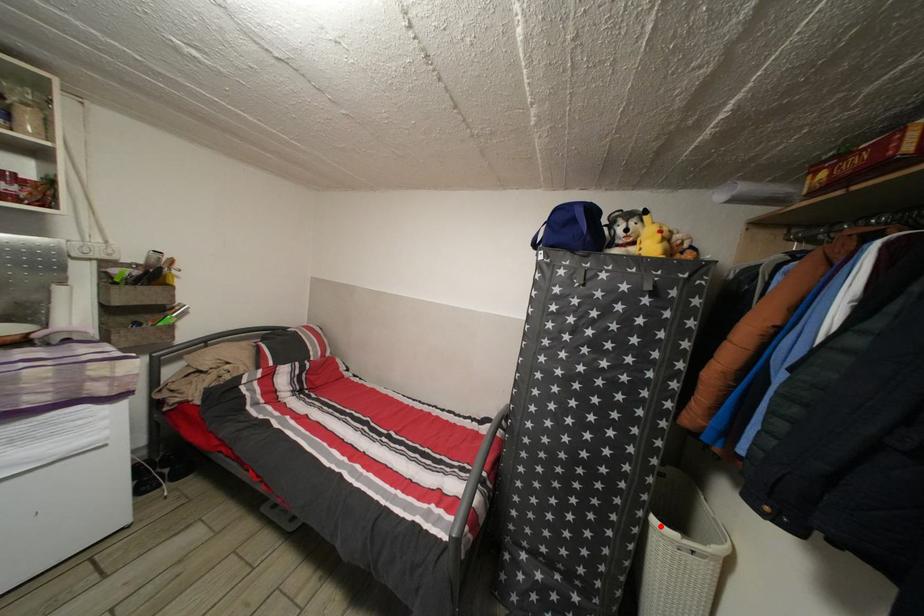
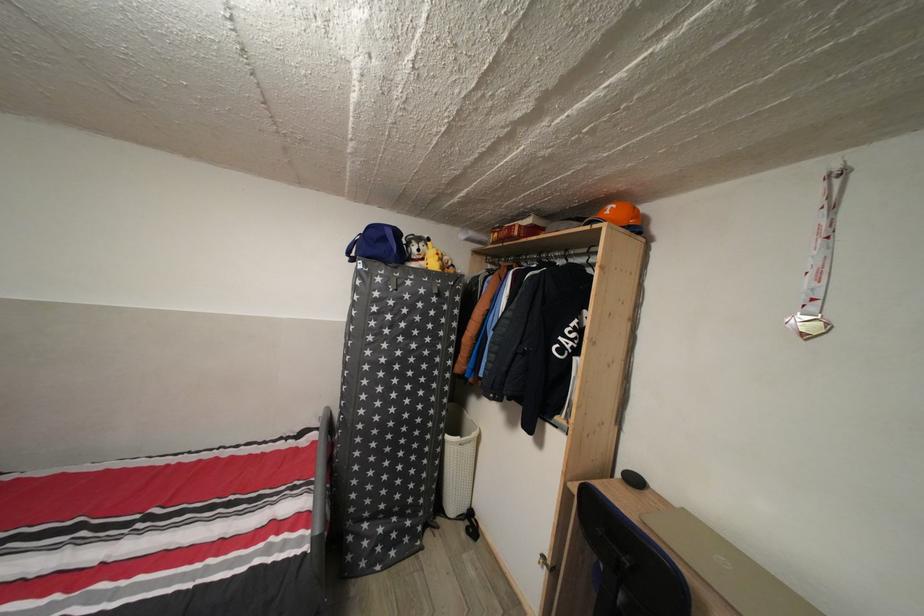
Where in the second image is the point corresponding to the highlighted location from the first image?

(455, 444)